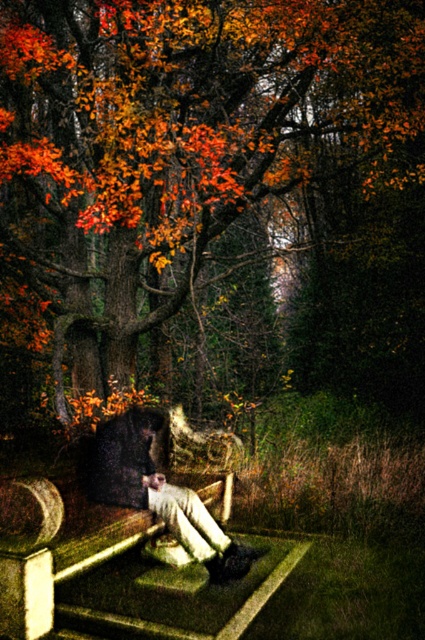
Question: Does autumn leaves at center have a greater width compared to matte black coat at center?

Choices:
 (A) no
 (B) yes

Answer: (A)

Question: Among these points, which one is farthest from the camera?

Choices:
 (A) (240, 568)
 (B) (254, 118)

Answer: (B)

Question: Does autumn leaves at center have a larger size compared to matte black coat at center?

Choices:
 (A) no
 (B) yes

Answer: (A)

Question: Which object is farther from the camera taking this photo?

Choices:
 (A) matte black coat at center
 (B) autumn leaves at center

Answer: (B)

Question: Can you confirm if autumn leaves at center is wider than matte black coat at center?

Choices:
 (A) yes
 (B) no

Answer: (B)